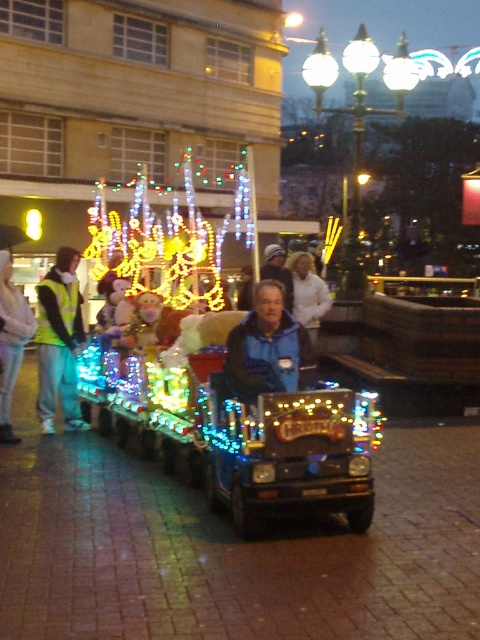
Is point (238, 387) more distant than point (21, 326)?

That is False.

Which is in front, point (269, 365) or point (11, 308)?

Point (269, 365) is more forward.

Image resolution: width=480 pixels, height=640 pixels. I want to click on blue fleece jacket at center, so click(266, 348).

Can you confirm if blue fleece jacket at center is positioned to the left of blue fabric jacket at center?

Yes, blue fleece jacket at center is to the left of blue fabric jacket at center.

Can you confirm if blue fleece jacket at center is positioned below blue fabric jacket at center?

Indeed, blue fleece jacket at center is positioned under blue fabric jacket at center.

The image size is (480, 640). I want to click on blue fleece jacket at center, so click(x=266, y=348).

Which is in front, point (1, 268) or point (282, 273)?

Point (1, 268) is in front.

Does reflective silver jacket at left appear on the right side of blue fabric jacket at center?

Incorrect, reflective silver jacket at left is not on the right side of blue fabric jacket at center.

Is point (16, 355) positioned before point (284, 273)?

Yes, point (16, 355) is closer to viewer.

Find the location of a particular element. This screenshot has height=640, width=480. reflective silver jacket at left is located at coordinates (11, 340).